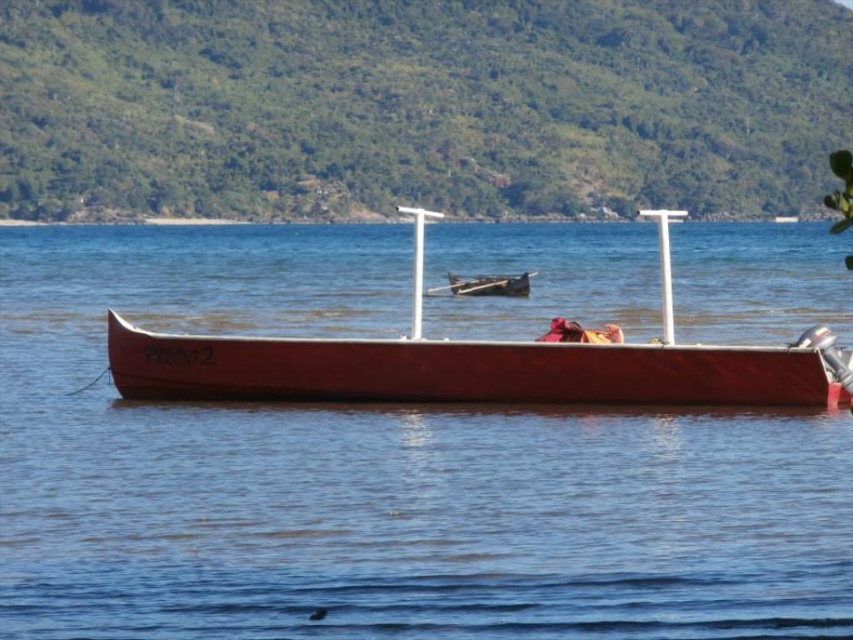
Consider the image. Who is more forward, [225,232] or [227,378]?

Positioned in front is point [227,378].

Who is higher up, smooth water at center or smooth red boat at center?

smooth water at center is higher up.

Measure the distance between smooth water at center and camera.

smooth water at center is 50.52 feet from camera.

The image size is (853, 640). What are the coordinates of `smooth water at center` in the screenshot? It's located at (373, 474).

Who is more distant from viewer, (436, 218) or (485, 280)?

The point (485, 280) is more distant.

Is smooth red boat at center in front of wooden paddle at center?

Yes, it is in front of wooden paddle at center.

The width and height of the screenshot is (853, 640). What do you see at coordinates (480, 362) in the screenshot?
I see `smooth red boat at center` at bounding box center [480, 362].

At what (x,y) coordinates should I click in order to perform the action: click on smooth red boat at center. Please return your answer as a coordinate pair (x, y). The image size is (853, 640). Looking at the image, I should click on (480, 362).

Which is above, smooth wood canoe at center or wooden paddle at center?

wooden paddle at center is higher up.

How distant is smooth wood canoe at center from wooden paddle at center?

smooth wood canoe at center and wooden paddle at center are 39.06 meters apart from each other.

This screenshot has height=640, width=853. Find the location of `smooth wood canoe at center`. smooth wood canoe at center is located at coordinates (463, 371).